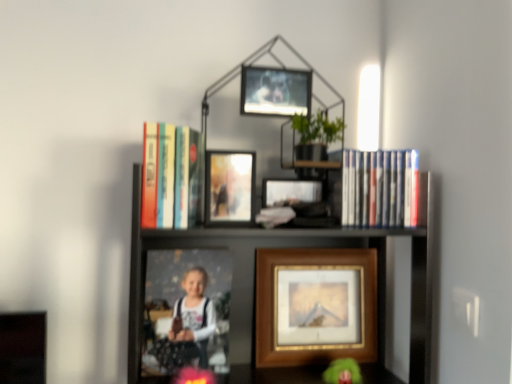
Question: Is point (251, 72) positioned closer to the camera than point (342, 185)?

Choices:
 (A) closer
 (B) farther

Answer: (A)

Question: In terms of width, does metallic silver picture frame at upper center, marked as the 1th picture frame in a top-to-bottom arrangement, look wider or thinner when compared to matte plastic dvds at upper right, acting as the 2th book starting from the left?

Choices:
 (A) thin
 (B) wide

Answer: (A)

Question: Estimate the real-world distances between objects in this image. Which object is closer to the matte plastic dvds at upper right, acting as the 2th book starting from the left?

Choices:
 (A) hardcover books at upper center, which appears as the first book when viewed from the left
 (B) matte glass picture frame at center, which ranks as the 3th picture frame in bottom-to-top order
 (C) wooden framed print at center, which appears as the fourth picture frame when viewed from the top
 (D) metallic silver picture frame at upper center, marked as the 1th picture frame in a top-to-bottom arrangement
 (E) black matte bookshelf at upper center

Answer: (D)

Question: Which is farther from the matte plastic photo frame at center, which is counted as the 3th picture frame, starting from the top?

Choices:
 (A) black matte bookshelf at upper center
 (B) matte glass picture frame at center, arranged as the 4th picture frame when viewed from the back
 (C) hardcover books at upper center, which appears as the first book when viewed from the left
 (D) wooden framed print at center, which is the first picture frame from back to front
 (E) metallic silver picture frame at upper center, the fourth picture frame when ordered from bottom to top

Answer: (E)